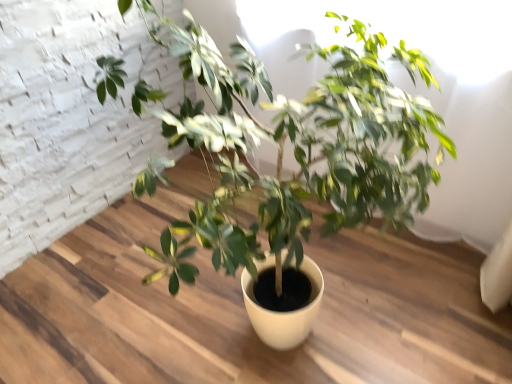
In order to click on green matte plant at center in this screenshot , I will do `click(294, 149)`.

Describe the element at coordinates (294, 149) in the screenshot. I see `green matte plant at center` at that location.

At what (x,y) coordinates should I click in order to perform the action: click on green matte plant at center. Please return your answer as a coordinate pair (x, y). The image size is (512, 384). Looking at the image, I should click on tap(294, 149).